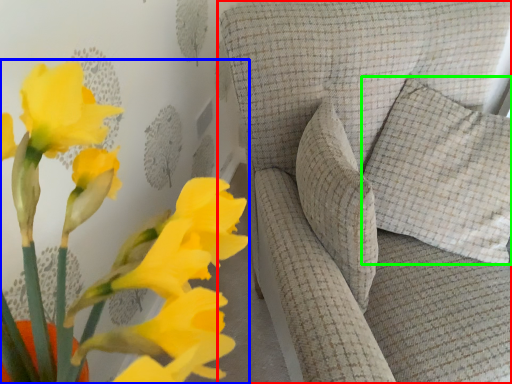
Question: Which is farther away from furniture (highlighted by a red box)? floral arrangement (highlighted by a blue box) or pillow (highlighted by a green box)?

Choices:
 (A) floral arrangement
 (B) pillow

Answer: (A)